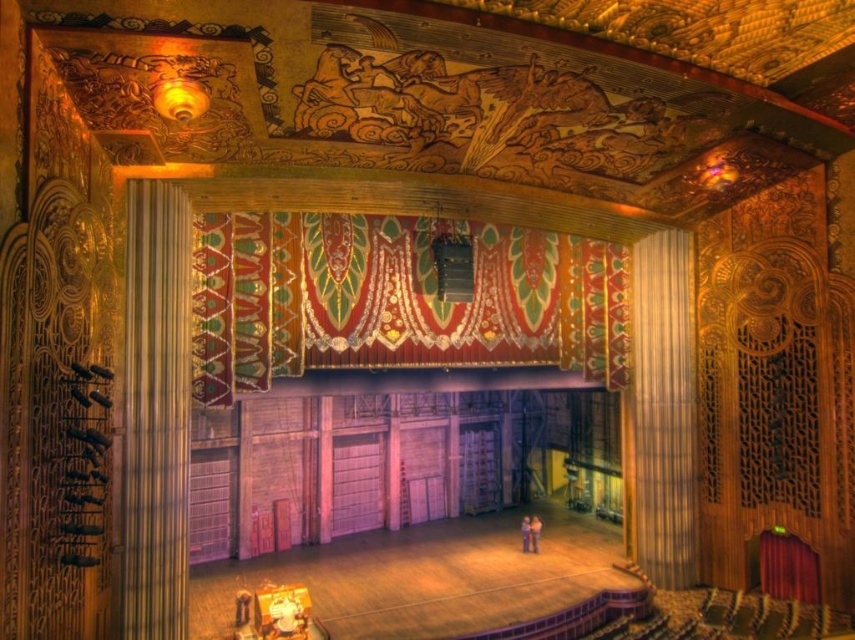
In the theater scene, there are two decorative elements on the stage area. The velvet tapestry at center and the gold textured curtain at right. Which one is positioned to the left of the other?

The velvet tapestry at center is positioned to the left of the gold textured curtain at right.